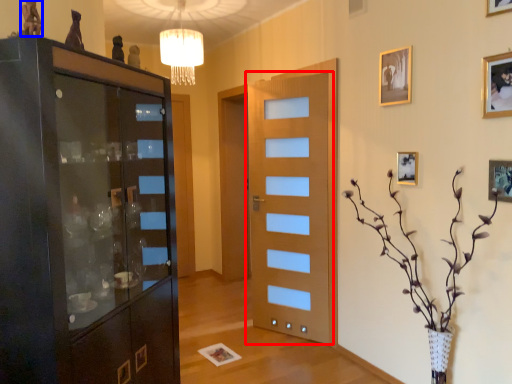
Question: Which object is closer to the camera taking this photo, door (highlighted by a red box) or art (highlighted by a blue box)?

Choices:
 (A) door
 (B) art

Answer: (B)